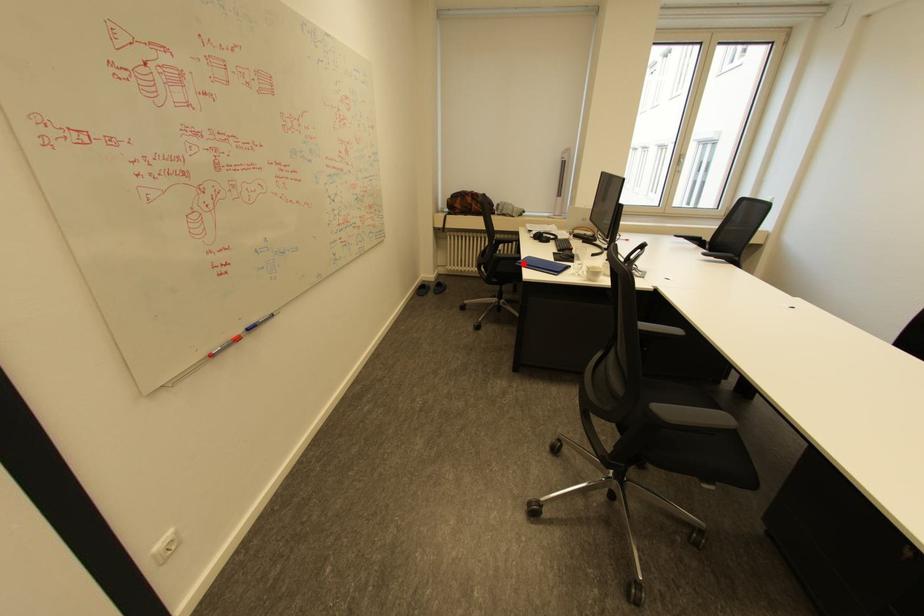
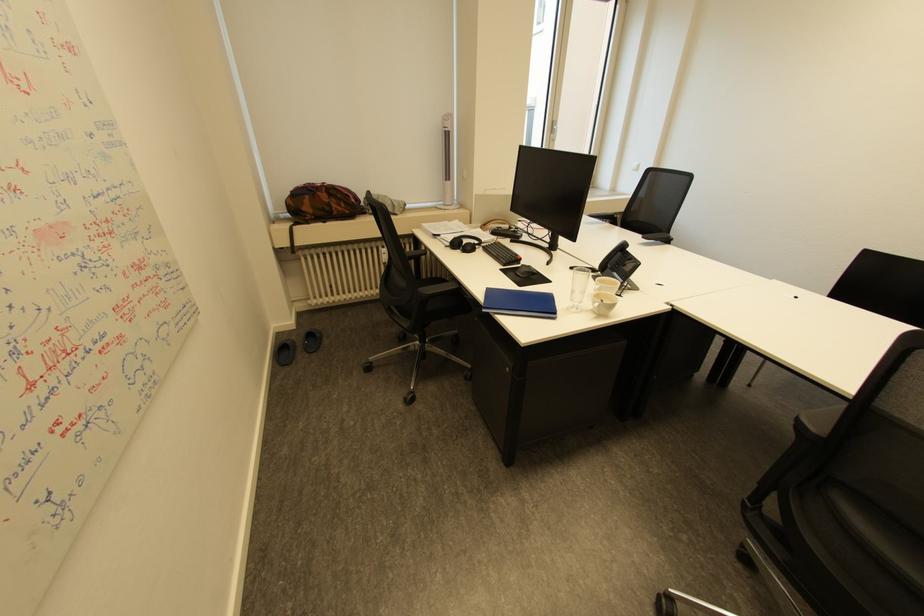
Question: I am providing you with two images of the same scene from different viewpoints. A red point is marked on the first image. Can you still see the location of the red point in image 2?

Choices:
 (A) Yes
 (B) No

Answer: (A)